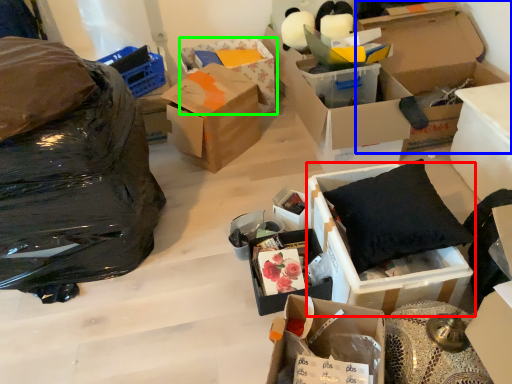
Question: Estimate the real-world distances between objects in this image. Which object is closer to box (highlighted by a red box), box (highlighted by a blue box) or box (highlighted by a green box)?

Choices:
 (A) box
 (B) box

Answer: (A)